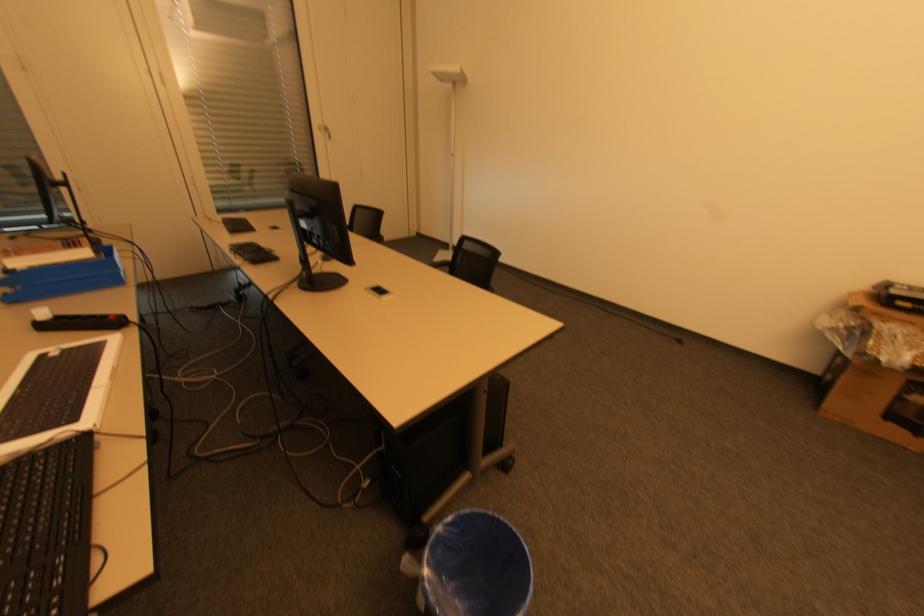
Where is `blue trash can`? The height and width of the screenshot is (616, 924). blue trash can is located at coordinates (476, 567).